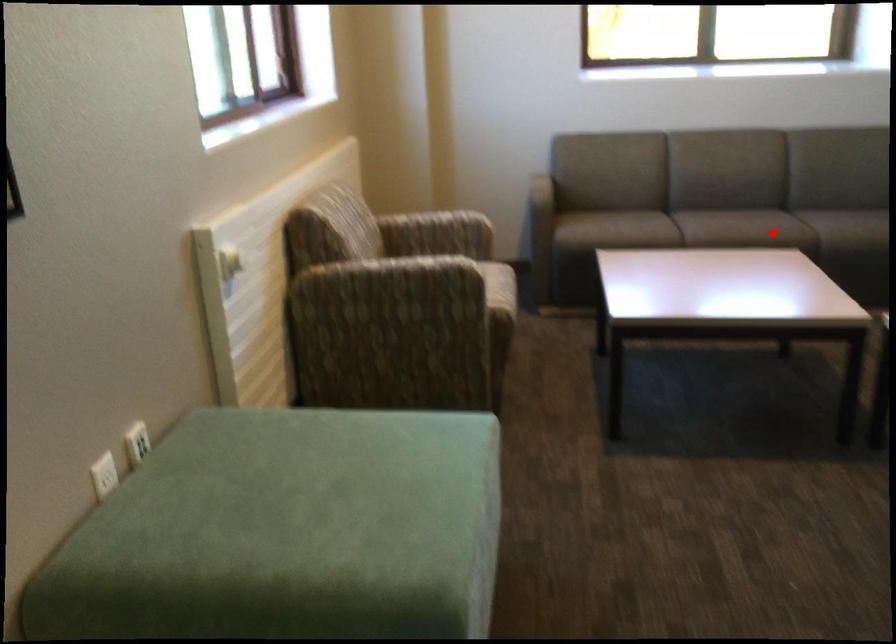
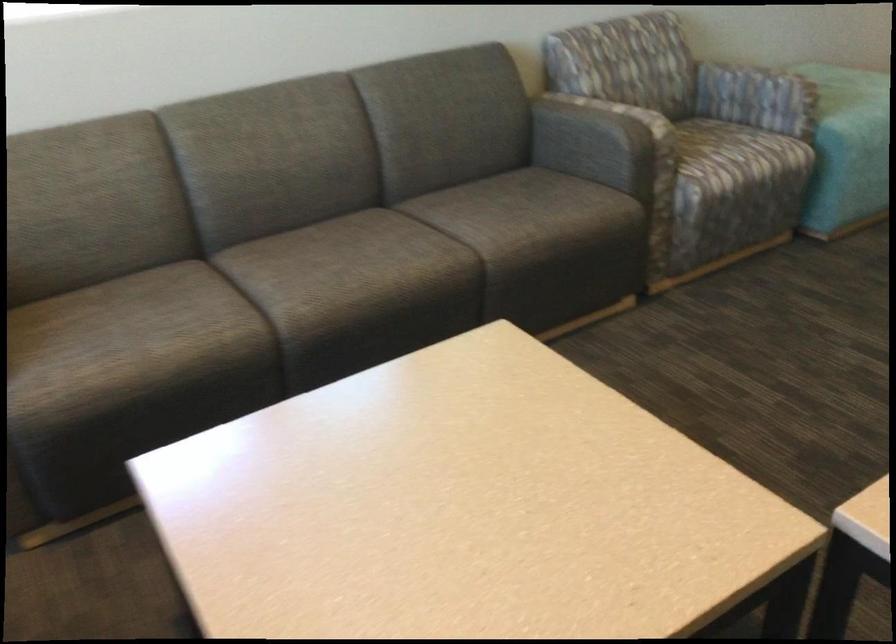
Question: I am providing you with two images of the same scene from different viewpoints. A red point is marked on the first image. Can you still see the location of the red point in image 2?

Choices:
 (A) Yes
 (B) No

Answer: (A)